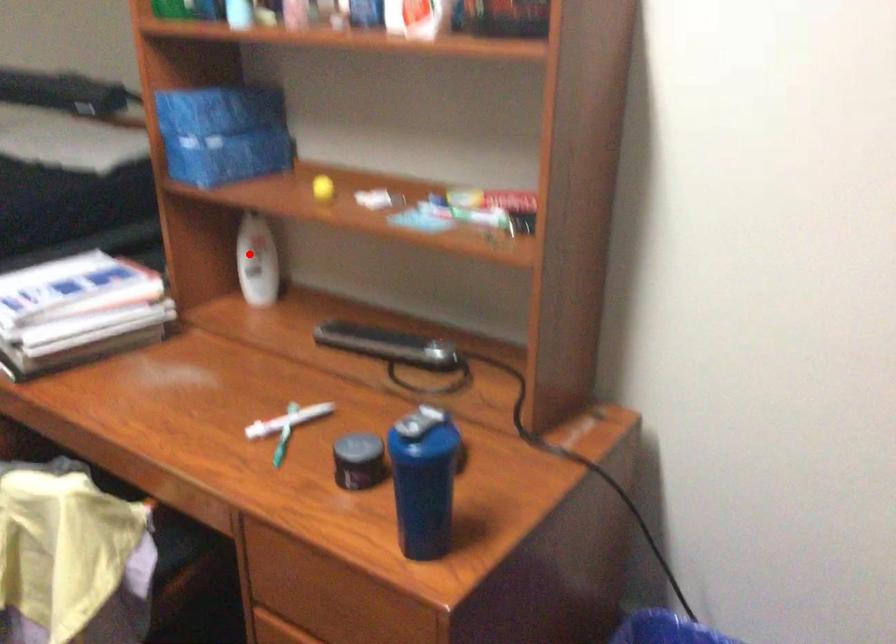
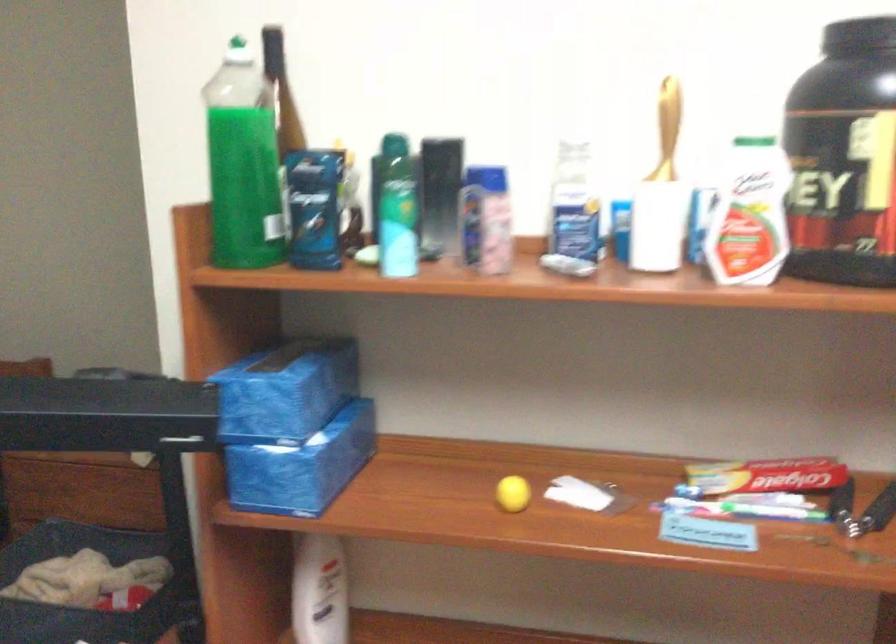
Where in the second image is the point corresponding to the highlighted location from the first image?

(319, 591)